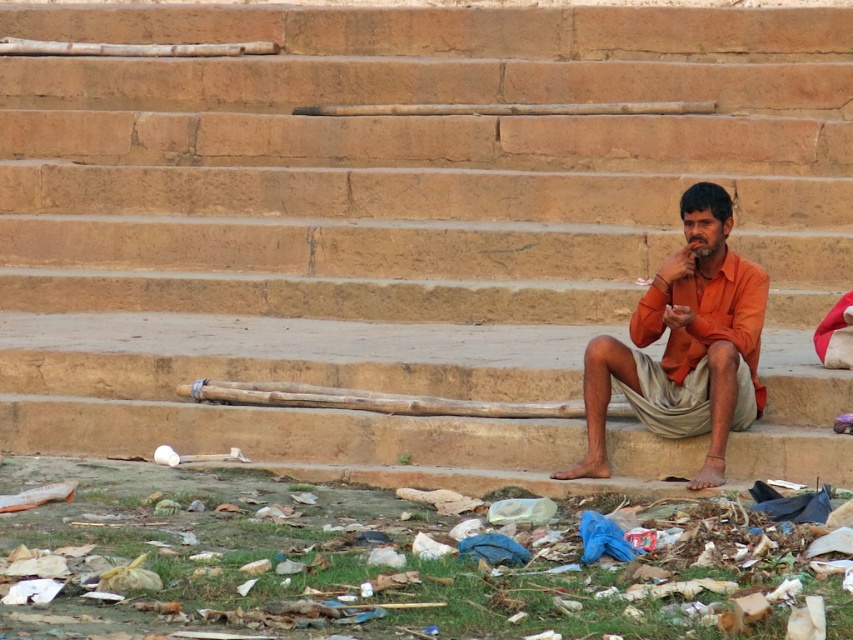
Which of these two, plastic bag at lower center or orange cotton shirt at center, stands shorter?

Standing shorter between the two is plastic bag at lower center.

Does plastic bag at lower center have a greater height compared to orange cotton shirt at center?

In fact, plastic bag at lower center may be shorter than orange cotton shirt at center.

Is point (500, 563) less distant than point (697, 214)?

Yes, point (500, 563) is closer to viewer.

You are a GUI agent. You are given a task and a screenshot of the screen. Output one action in this format:
    pyautogui.click(x=<x>, y=<y>)
    Task: Click on the plastic bag at lower center
    
    Given the screenshot: What is the action you would take?
    pyautogui.click(x=370, y=563)